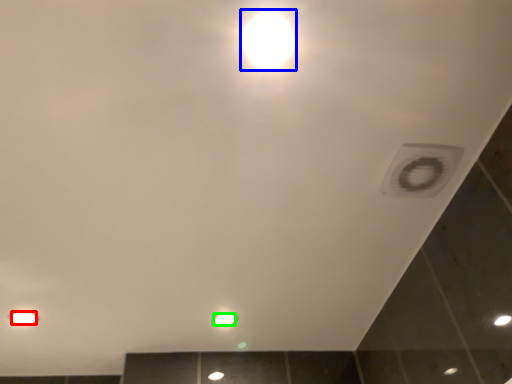
Question: Based on their relative distances, which object is nearer to light bulb (highlighted by a red box)? Choose from light bulb (highlighted by a blue box) and light bulb (highlighted by a green box).

Choices:
 (A) light bulb
 (B) light bulb

Answer: (B)